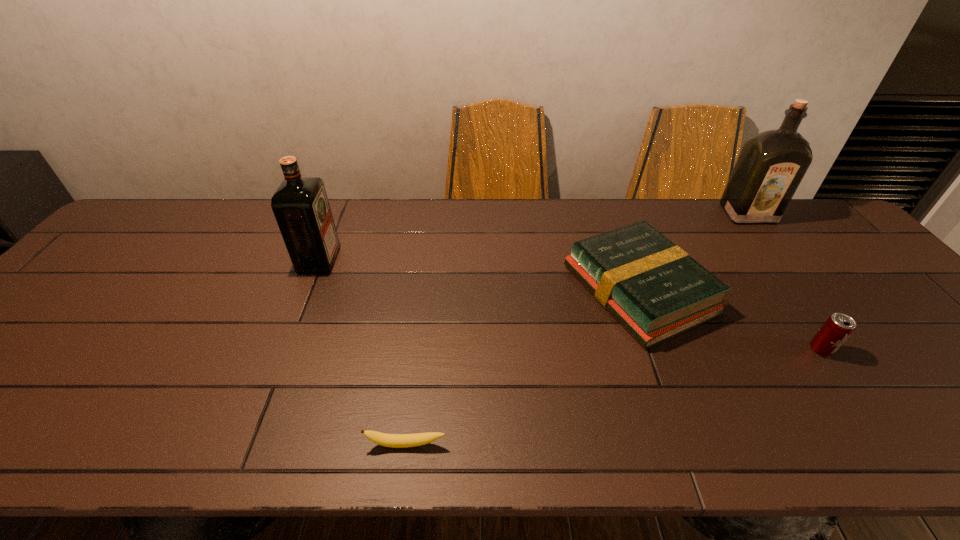
Find the location of `free space between the hardback book and the left liquor`. free space between the hardback book and the left liquor is located at coordinates (479, 275).

Where is `free space between the beer can and the third object from left to right`? free space between the beer can and the third object from left to right is located at coordinates (730, 320).

The image size is (960, 540). In order to click on free space between the second object from left to right and the right liquor in this screenshot , I will do `click(577, 329)`.

Locate an element on the screen. The width and height of the screenshot is (960, 540). vacant space that's between the second object from left to right and the second tallest object is located at coordinates (362, 352).

The width and height of the screenshot is (960, 540). I want to click on free spot between the left liquor and the beer can, so click(x=570, y=305).

The height and width of the screenshot is (540, 960). In order to click on unoccupied area between the beer can and the farther liquor in this screenshot , I will do `click(784, 281)`.

Image resolution: width=960 pixels, height=540 pixels. What are the coordinates of `vacant area that lies between the shorter liquor and the fourth object from right to left` in the screenshot? It's located at (362, 352).

Find the location of a particular element. The height and width of the screenshot is (540, 960). blank region between the third object from left to right and the beer can is located at coordinates (730, 320).

Where is `free space between the farther liquor and the beer can`? free space between the farther liquor and the beer can is located at coordinates (784, 281).

Identify the location of unoccupied area between the nearest object and the farthest object. This screenshot has width=960, height=540. (577, 329).